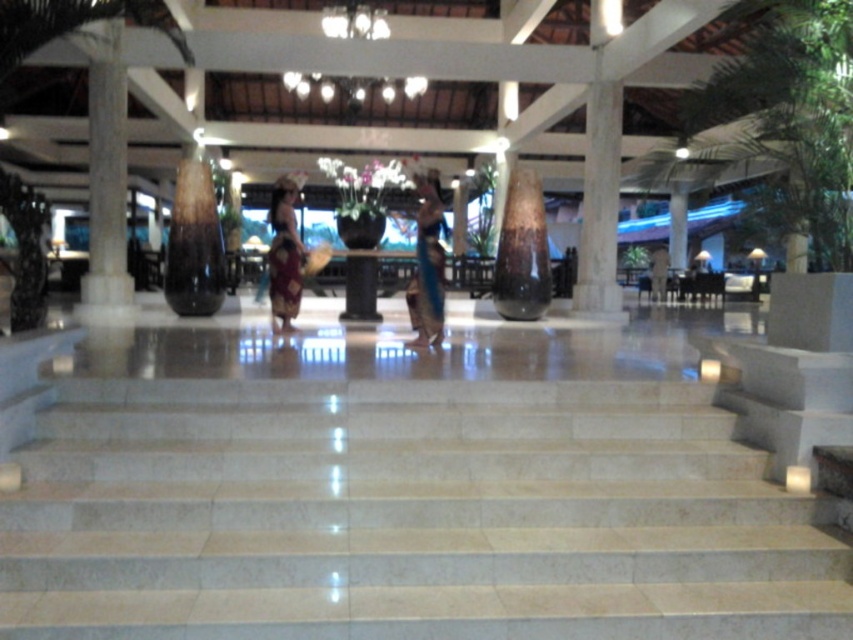
Looking at this image, is white marble pillar at center positioned at the back of dark brown leather jacket at center?

No, it is in front of dark brown leather jacket at center.

The width and height of the screenshot is (853, 640). What do you see at coordinates (599, 204) in the screenshot?
I see `white marble pillar at center` at bounding box center [599, 204].

Does point (618, 81) come in front of point (657, 268)?

Yes, it is.

Identify the location of white marble pillar at center. This screenshot has height=640, width=853. (599, 204).

Which is more to the right, beige marble stairs at center or matte purple skirt at center?

beige marble stairs at center is more to the right.

Between beige marble stairs at center and matte purple skirt at center, which one appears on the left side from the viewer's perspective?

matte purple skirt at center

The width and height of the screenshot is (853, 640). Identify the location of beige marble stairs at center. (407, 515).

Where is `beige marble stairs at center`? beige marble stairs at center is located at coordinates (407, 515).

Is beige marble stairs at center shorter than blue silk dress at center?

Correct, beige marble stairs at center is not as tall as blue silk dress at center.

Who is positioned more to the left, beige marble stairs at center or blue silk dress at center?

beige marble stairs at center

Image resolution: width=853 pixels, height=640 pixels. Identify the location of beige marble stairs at center. (407, 515).